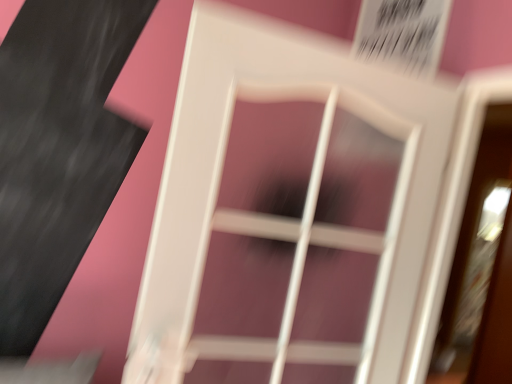
This screenshot has width=512, height=384. Find the location of `white glossy window at center`. white glossy window at center is located at coordinates (316, 239).

What do you see at coordinates (316, 239) in the screenshot? I see `white glossy window at center` at bounding box center [316, 239].

Where is `white glossy window at center`? Image resolution: width=512 pixels, height=384 pixels. white glossy window at center is located at coordinates coord(316,239).